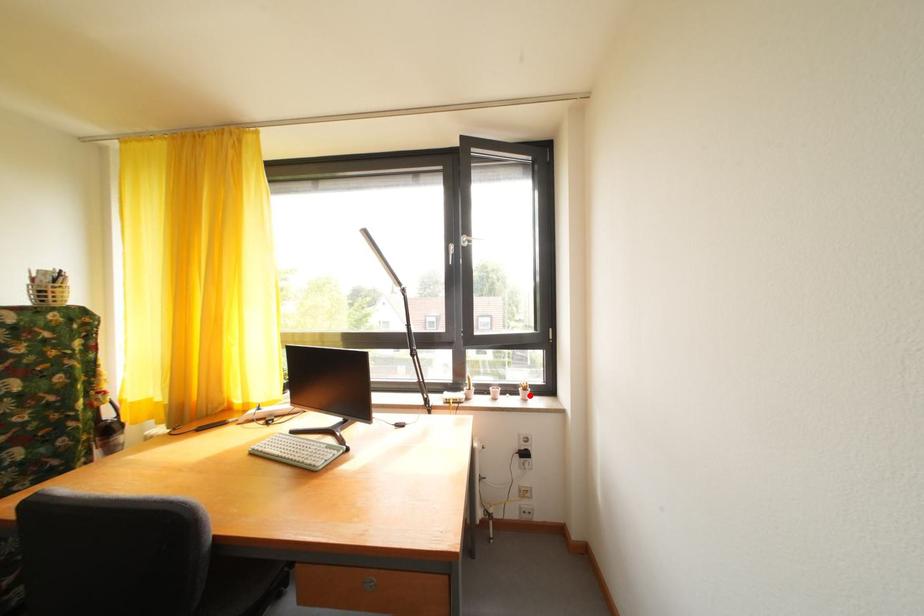
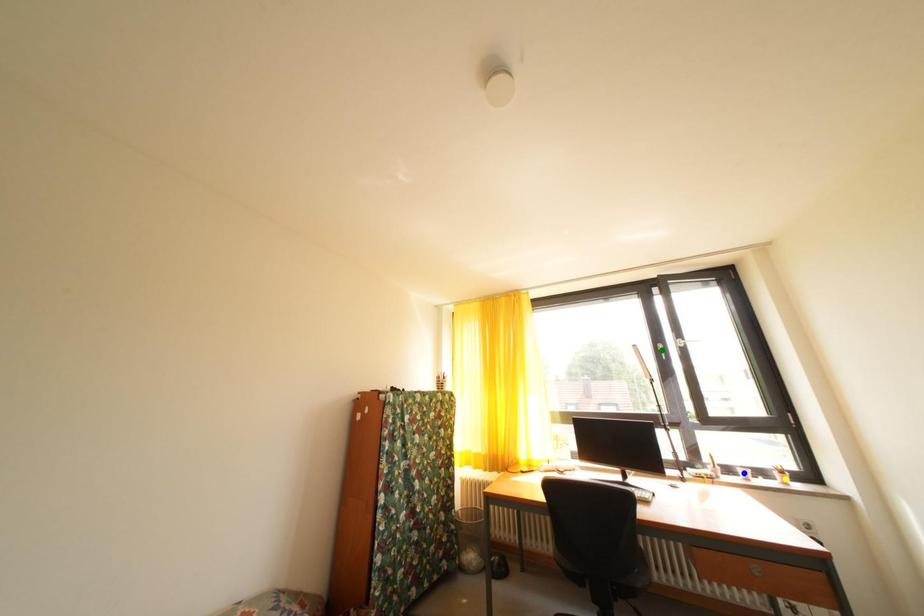
Question: I am providing you with two images of the same scene from different viewpoints. A red point is marked on the first image. You are given multiple points on the second image. Which point in image 2 represents the same 3d spot as the red point in image 1?

Choices:
 (A) green point
 (B) yellow point
 (C) blue point

Answer: (B)